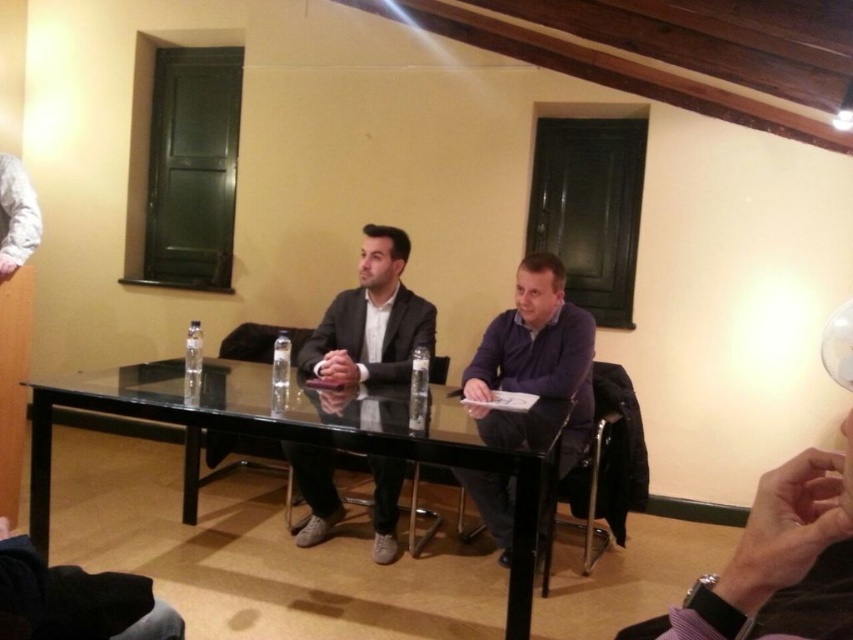
Question: Is transparent glass table at center bigger than matte black suit at center?

Choices:
 (A) yes
 (B) no

Answer: (A)

Question: Can you confirm if transparent glass table at center is positioned to the left of matte black suit at center?

Choices:
 (A) no
 (B) yes

Answer: (B)

Question: Among these objects, which one is nearest to the camera?

Choices:
 (A) purple matte shirt at center
 (B) matte black suit at center

Answer: (A)

Question: Which object is the closest to the purple matte shirt at center?

Choices:
 (A) matte black suit at center
 (B) transparent glass table at center

Answer: (A)

Question: Among these points, which one is farthest from the camera?

Choices:
 (A) (366, 296)
 (B) (462, 477)
 (C) (527, 547)

Answer: (A)

Question: Is the position of matte black suit at center more distant than that of purple matte shirt at center?

Choices:
 (A) yes
 (B) no

Answer: (A)